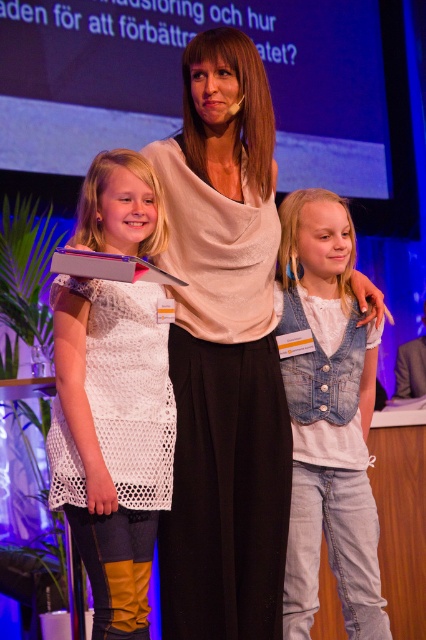
Question: Which point appears closest to the camera in this image?

Choices:
 (A) (109, 369)
 (B) (316, 419)
 (C) (278, 394)

Answer: (A)

Question: Can you confirm if white crochet dress at center is positioned below denim vest at center?

Choices:
 (A) yes
 (B) no

Answer: (B)

Question: From the image, what is the correct spatial relationship of white crochet dress at center in relation to denim vest at center?

Choices:
 (A) below
 (B) above

Answer: (B)

Question: Where is matte white blouse at center located in relation to denim vest at center in the image?

Choices:
 (A) above
 (B) below

Answer: (A)

Question: Among these points, which one is farthest from the camera?

Choices:
 (A) (104, 560)
 (B) (233, 452)
 (C) (285, 234)

Answer: (C)

Question: Among these points, which one is farthest from the camera?

Choices:
 (A) (317, 515)
 (B) (273, 188)
 (C) (118, 438)

Answer: (B)